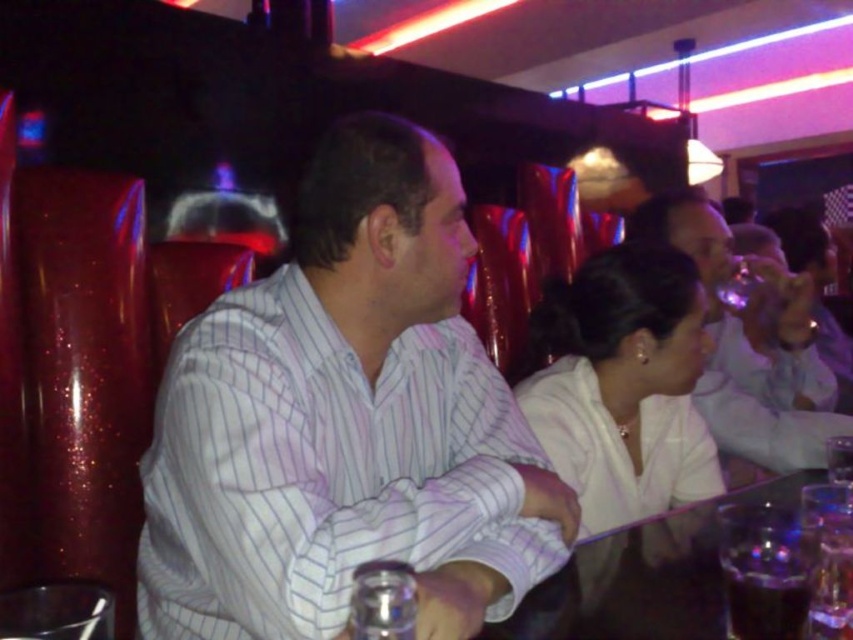
Can you confirm if white striped shirt at center is taller than dark liquid glass at lower right?

Indeed, white striped shirt at center has a greater height compared to dark liquid glass at lower right.

I want to click on white striped shirt at center, so click(x=345, y=422).

I want to click on white striped shirt at center, so click(x=345, y=422).

Between white glossy shirt at upper right and translucent glass table at center, which one has more height?

With more height is white glossy shirt at upper right.

From the picture: Measure the distance between point (x=751, y=342) and camera.

They are 6.45 feet apart.

Locate an element on the screen. This screenshot has width=853, height=640. white glossy shirt at upper right is located at coordinates (750, 342).

Between white satin blouse at center and translucent glass table at center, which one appears on the left side from the viewer's perspective?

white satin blouse at center

Based on the photo, who is more forward, (616, 525) or (781, 477)?

Point (616, 525) is more forward.

The height and width of the screenshot is (640, 853). What are the coordinates of `white satin blouse at center` in the screenshot? It's located at (622, 385).

Where is `white satin blouse at center`? The height and width of the screenshot is (640, 853). white satin blouse at center is located at coordinates (622, 385).